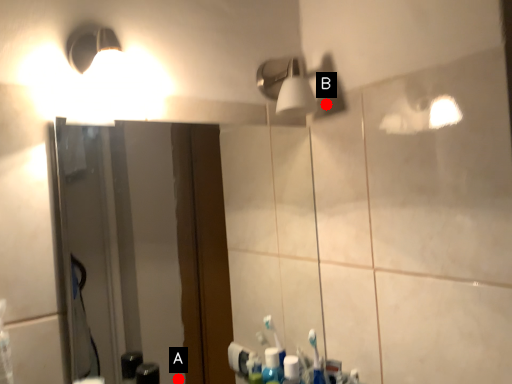
Question: Two points are circled on the image, labeled by A and B beside each circle. Which point is closer to the camera taking this photo?

Choices:
 (A) A is closer
 (B) B is closer

Answer: (B)